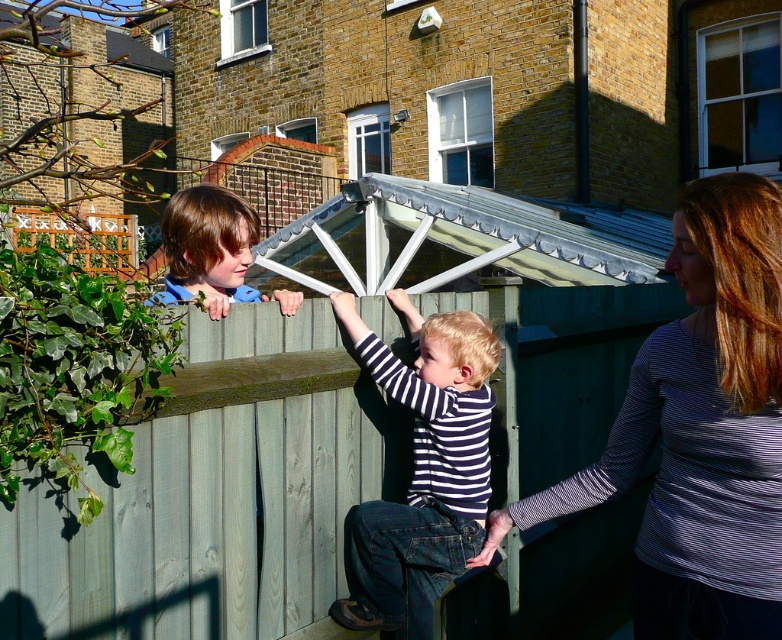
Is green wood fence at center smaller than striped cotton shirt at center?

Actually, green wood fence at center might be larger than striped cotton shirt at center.

Describe the element at coordinates (216, 496) in the screenshot. I see `green wood fence at center` at that location.

The height and width of the screenshot is (640, 782). Find the location of `green wood fence at center`. green wood fence at center is located at coordinates (216, 496).

From the picture: Is striped cotton shirt at center taller than matte brown hair at upper left?

Correct, striped cotton shirt at center is much taller as matte brown hair at upper left.

This screenshot has height=640, width=782. Describe the element at coordinates (421, 470) in the screenshot. I see `striped cotton shirt at center` at that location.

The image size is (782, 640). Find the location of `striped cotton shirt at center`. striped cotton shirt at center is located at coordinates (421, 470).

Is green wood fence at center smaller than striped long-sleeve shirt at center?

Actually, green wood fence at center might be larger than striped long-sleeve shirt at center.

Is point (336, 342) closer to camera compared to point (744, 292)?

No, it is not.

Where is `green wood fence at center`? The image size is (782, 640). green wood fence at center is located at coordinates (216, 496).